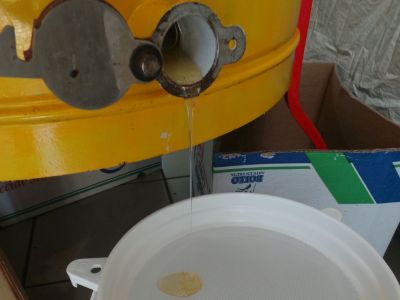
Find the location of a particular element. This screenshot has width=400, height=300. tile is located at coordinates (117, 215).